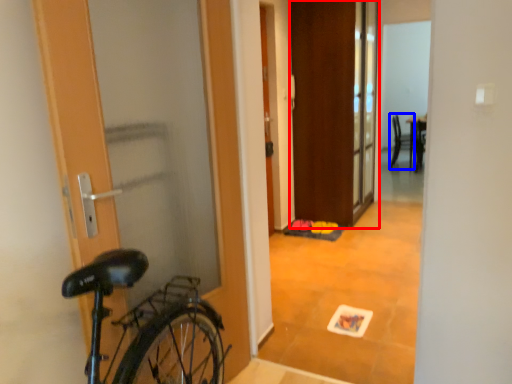
Question: Which point is further to the camera, door (highlighted by a red box) or chair (highlighted by a blue box)?

Choices:
 (A) door
 (B) chair

Answer: (B)